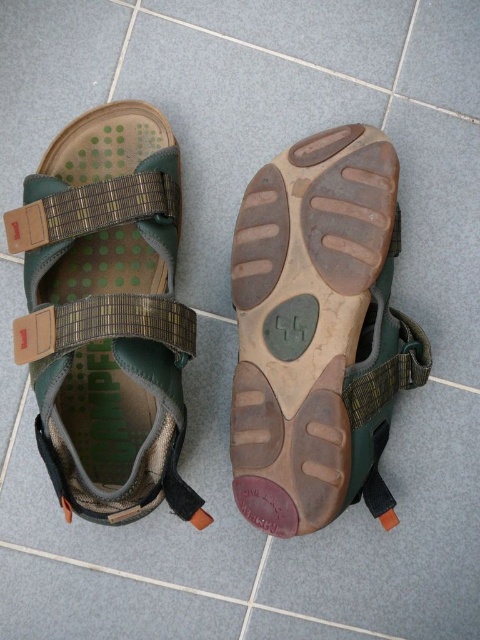
Question: Can you confirm if brown rubber sandal at center is positioned to the left of green fabric sandal at center?

Choices:
 (A) no
 (B) yes

Answer: (A)

Question: Is brown rubber sandal at center below green fabric sandal at center?

Choices:
 (A) yes
 (B) no

Answer: (A)

Question: Which object appears closest to the camera in this image?

Choices:
 (A) brown rubber sandal at center
 (B) green fabric sandal at center

Answer: (B)

Question: Is brown rubber sandal at center above green fabric sandal at center?

Choices:
 (A) yes
 (B) no

Answer: (B)

Question: Which object is closer to the camera taking this photo?

Choices:
 (A) brown rubber sandal at center
 (B) green fabric sandal at center

Answer: (B)